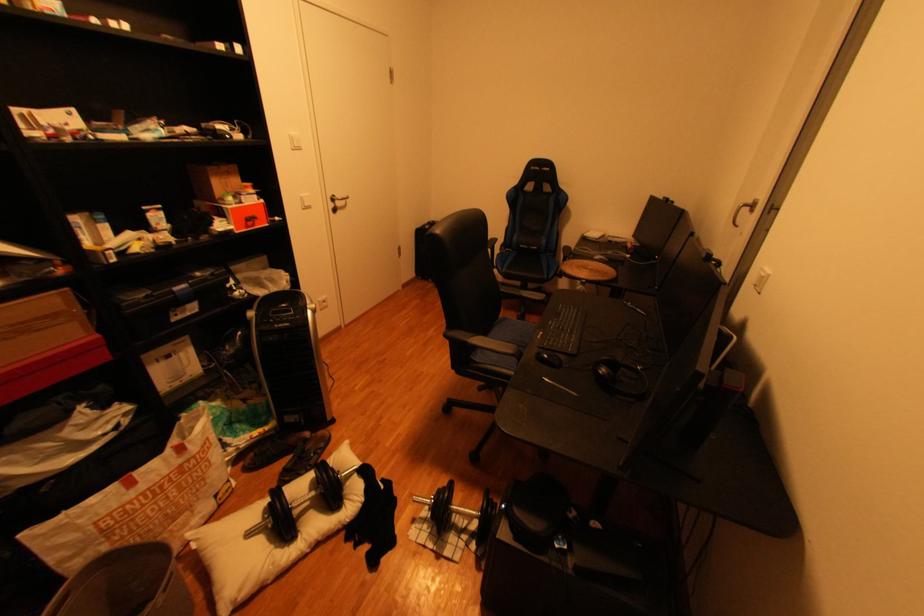
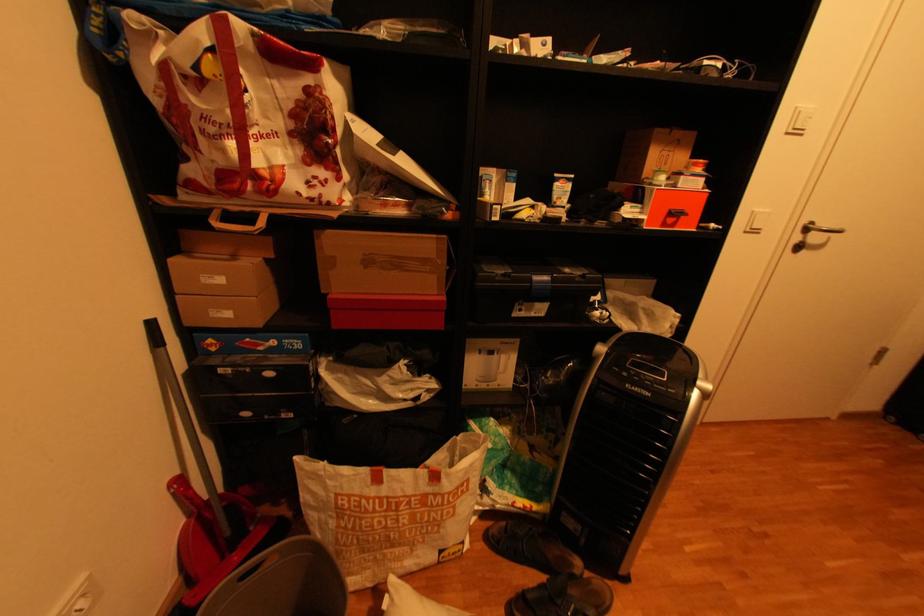
Find the pixel in the second image that matches (x=344, y=201) in the first image.

(816, 230)